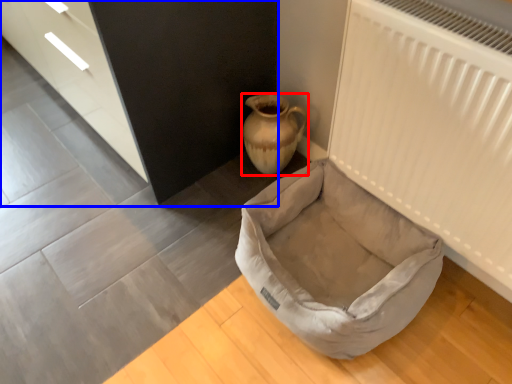
Question: Which point is further to the camera, vase (highlighted by a red box) or dresser (highlighted by a blue box)?

Choices:
 (A) vase
 (B) dresser

Answer: (A)